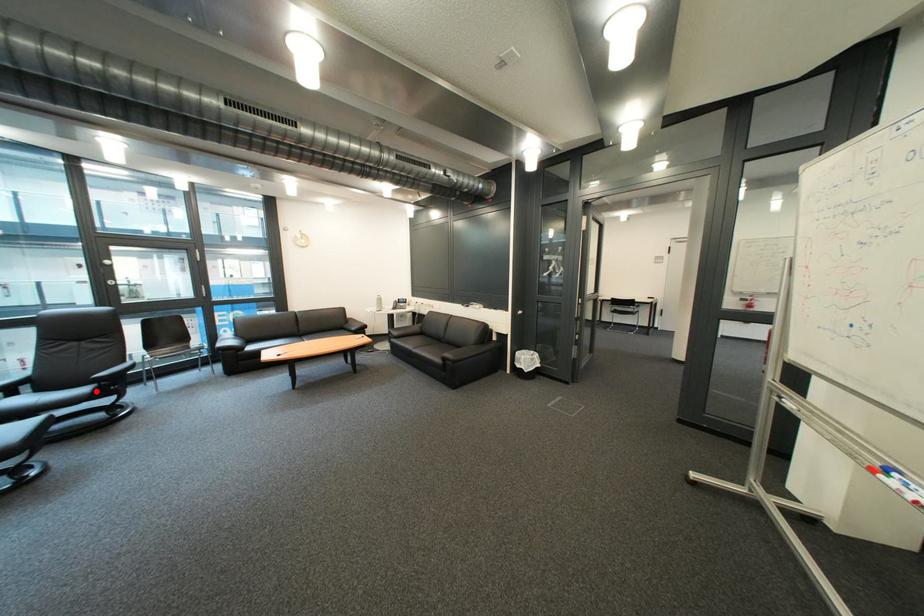
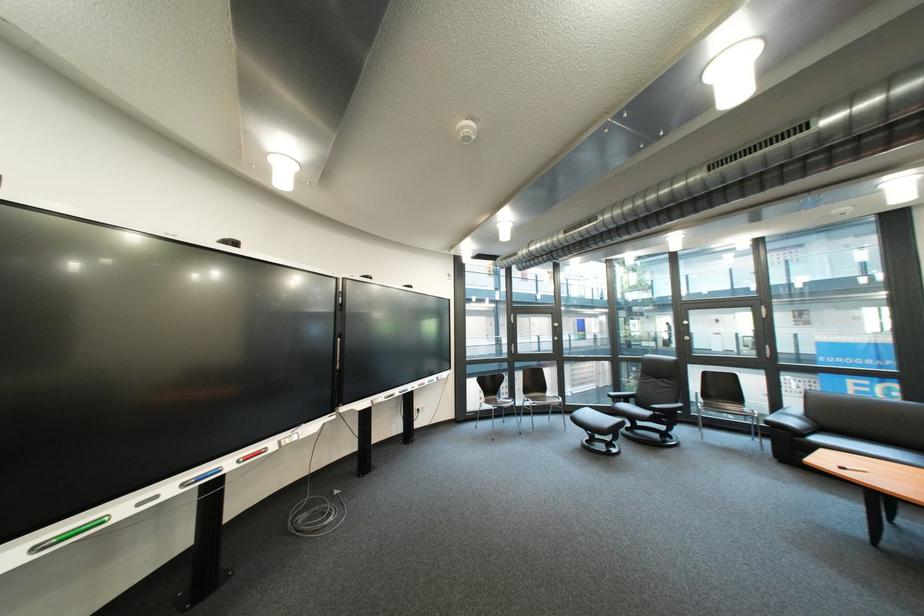
Where in the second image is the point corresponding to the highlighted location from the first image?

(661, 415)